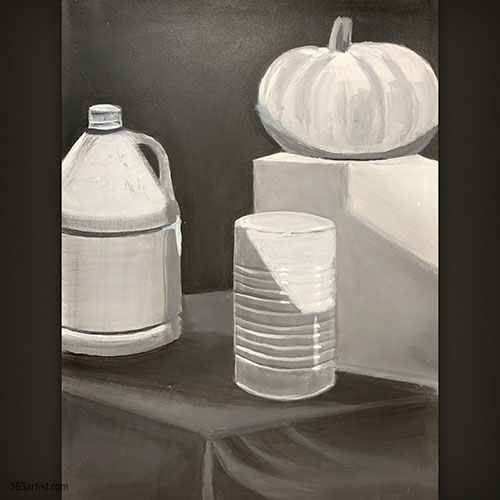
Where is `bottle`? Image resolution: width=500 pixels, height=500 pixels. bottle is located at coordinates click(x=114, y=219).